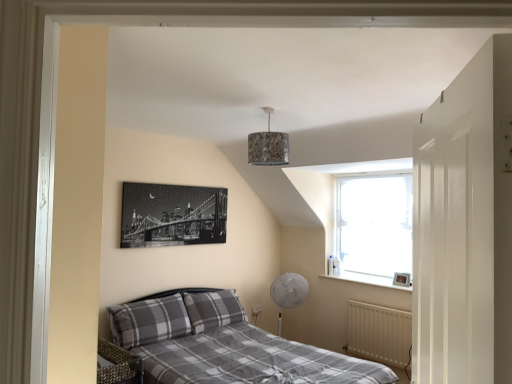
Question: Considering the relative positions of camouflage fabric lampshade at center and black and white canvas at upper left, the first picture frame from the top, in the image provided, is camouflage fabric lampshade at center to the left of black and white canvas at upper left, the first picture frame from the top, from the viewer's perspective?

Choices:
 (A) no
 (B) yes

Answer: (A)

Question: Is camouflage fabric lampshade at center surrounding black and white canvas at upper left, which is the 2th picture frame in bottom-to-top order?

Choices:
 (A) no
 (B) yes

Answer: (A)

Question: Does camouflage fabric lampshade at center appear on the right side of black and white canvas at upper left, the first picture frame from the top?

Choices:
 (A) yes
 (B) no

Answer: (A)

Question: From a real-world perspective, is camouflage fabric lampshade at center over black and white canvas at upper left, which is the 2th picture frame in bottom-to-top order?

Choices:
 (A) yes
 (B) no

Answer: (A)

Question: From a real-world perspective, is camouflage fabric lampshade at center below black and white canvas at upper left, arranged as the 2th picture frame when viewed from the right?

Choices:
 (A) no
 (B) yes

Answer: (A)

Question: Can you confirm if camouflage fabric lampshade at center is bigger than black and white canvas at upper left, arranged as the 2th picture frame when viewed from the right?

Choices:
 (A) no
 (B) yes

Answer: (A)

Question: Considering the relative positions of white matte radiator at lower right and plaid fabric bed at center in the image provided, is white matte radiator at lower right behind plaid fabric bed at center?

Choices:
 (A) no
 (B) yes

Answer: (B)

Question: Can you see white matte radiator at lower right touching plaid fabric bed at center?

Choices:
 (A) yes
 (B) no

Answer: (B)

Question: From the image's perspective, is white matte radiator at lower right above plaid fabric bed at center?

Choices:
 (A) no
 (B) yes

Answer: (A)

Question: Is white matte radiator at lower right not near plaid fabric bed at center?

Choices:
 (A) no
 (B) yes

Answer: (B)

Question: From a real-world perspective, is white matte radiator at lower right physically above plaid fabric bed at center?

Choices:
 (A) yes
 (B) no

Answer: (A)

Question: Is white matte radiator at lower right wider than plaid fabric bed at center?

Choices:
 (A) yes
 (B) no

Answer: (B)

Question: Is camouflage fabric lampshade at center thinner than white matte radiator at lower right?

Choices:
 (A) no
 (B) yes

Answer: (A)